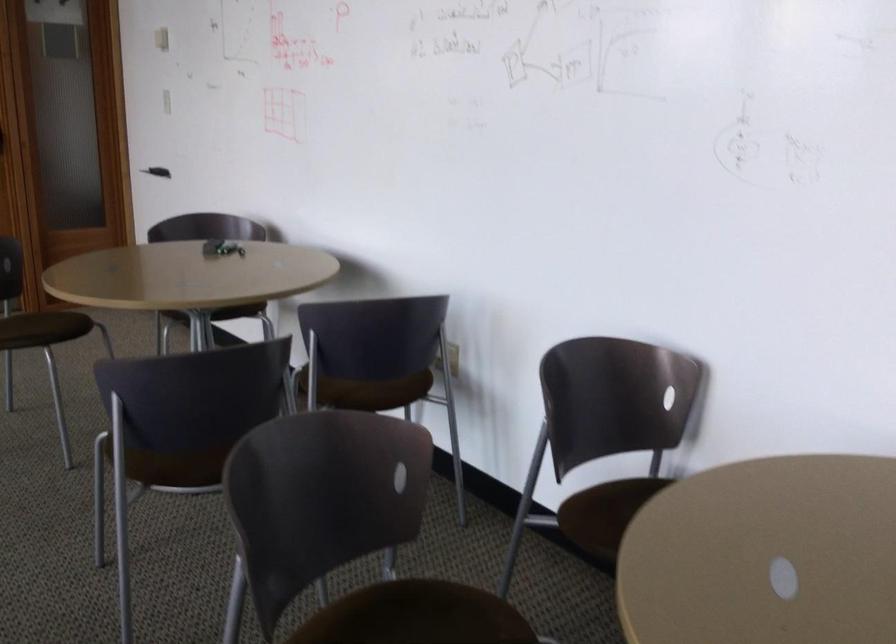
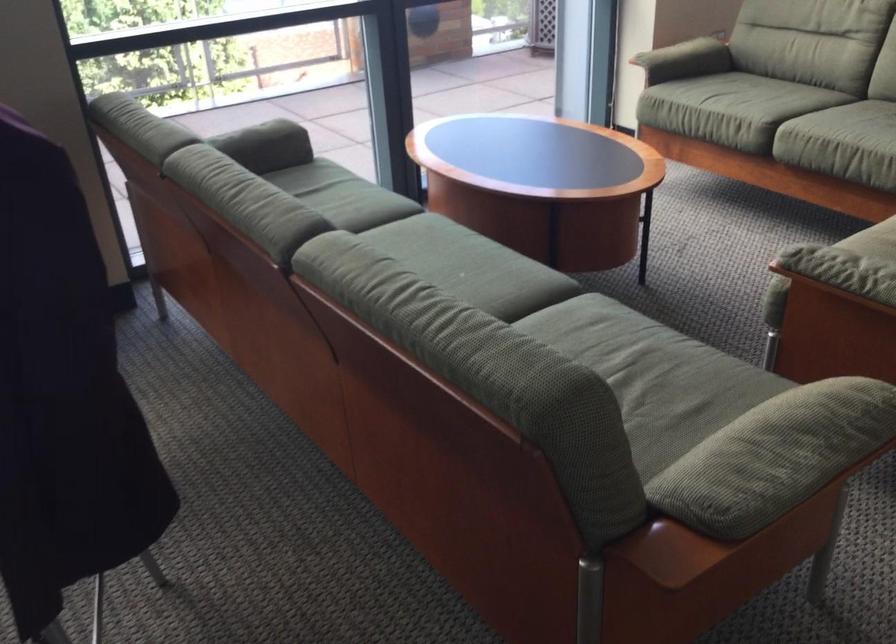
The first image is from the beginning of the video and the second image is from the end. How did the camera likely rotate when shooting the video?

The rotation direction of the camera is left-down.